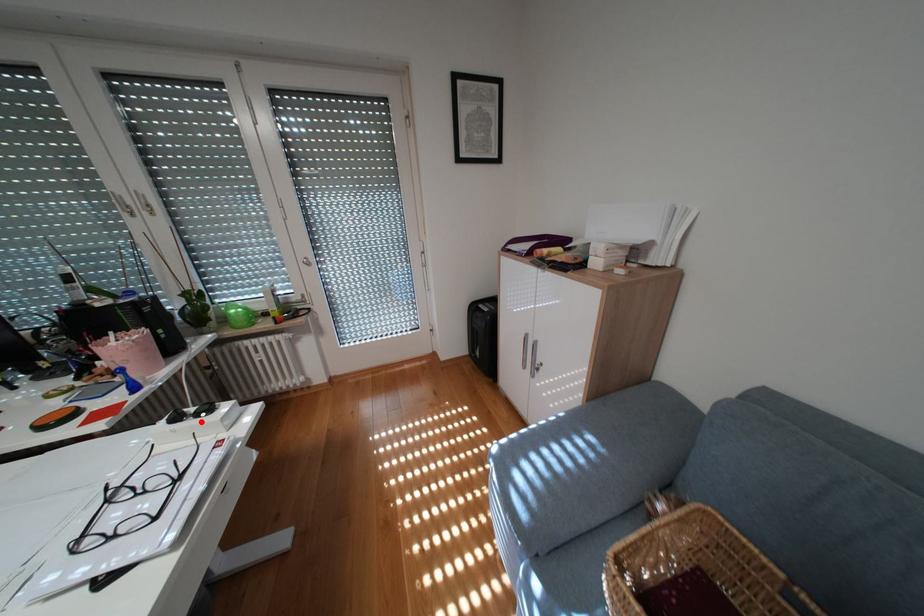
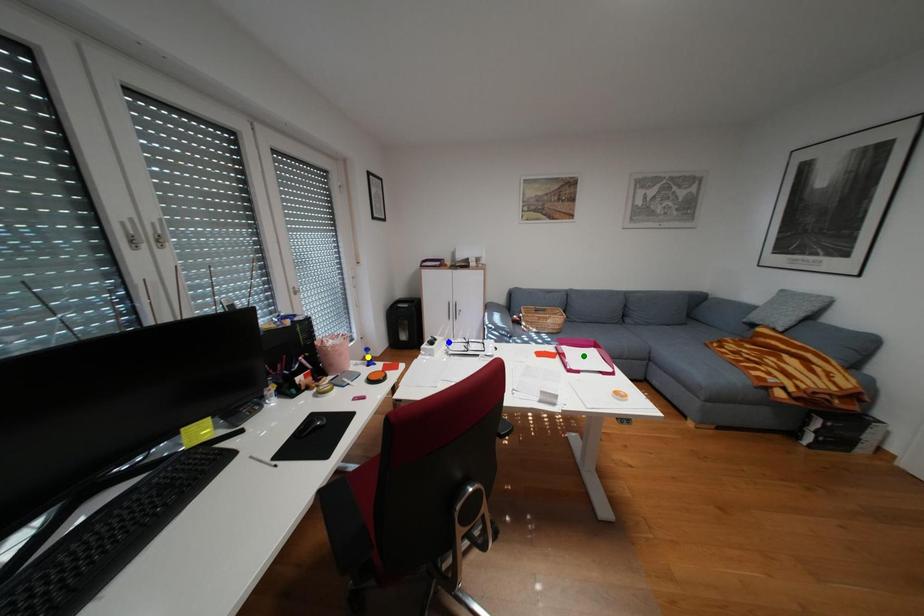
Question: I am providing you with two images of the same scene from different viewpoints. A red point is marked on the first image. You are given multiple points on the second image. Can you choose the point in image 2 that corresponds to the point in image 1?

Choices:
 (A) blue point
 (B) yellow point
 (C) green point

Answer: (A)